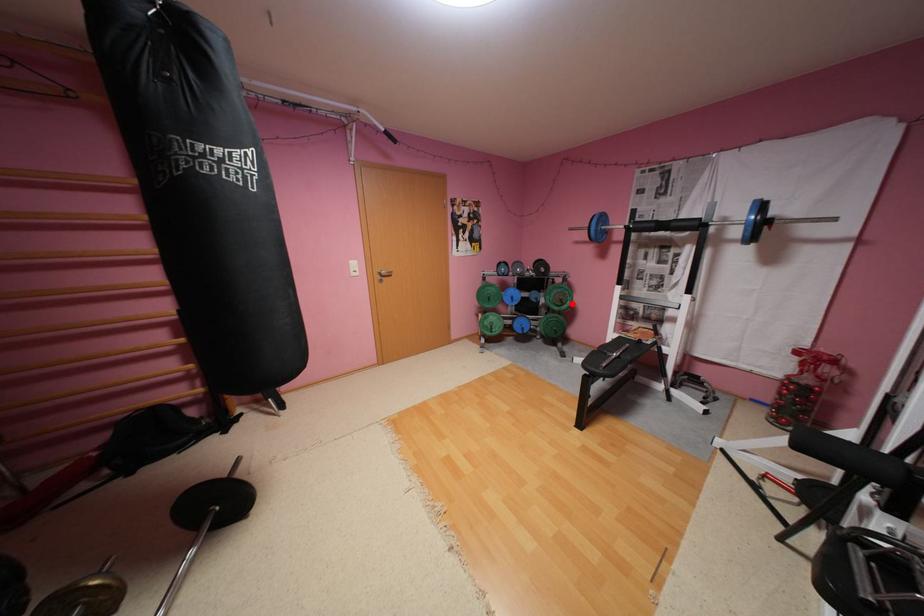
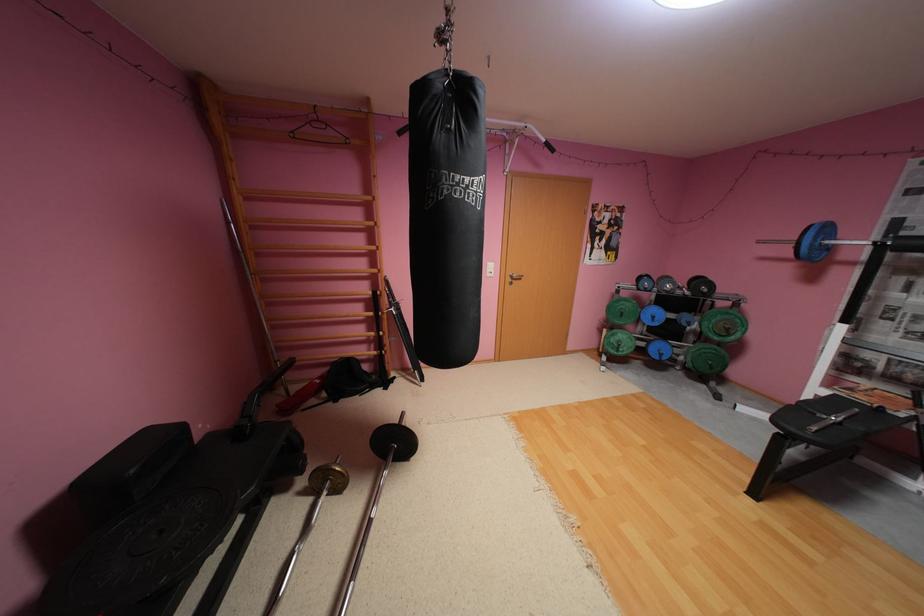
Question: I am providing you with two images of the same scene from different viewpoints. Image1 has a red point marked. In image2, the corresponding 3D location appears at what relative position? Reply with the corresponding letter.

Choices:
 (A) Closer
 (B) Farther

Answer: (A)